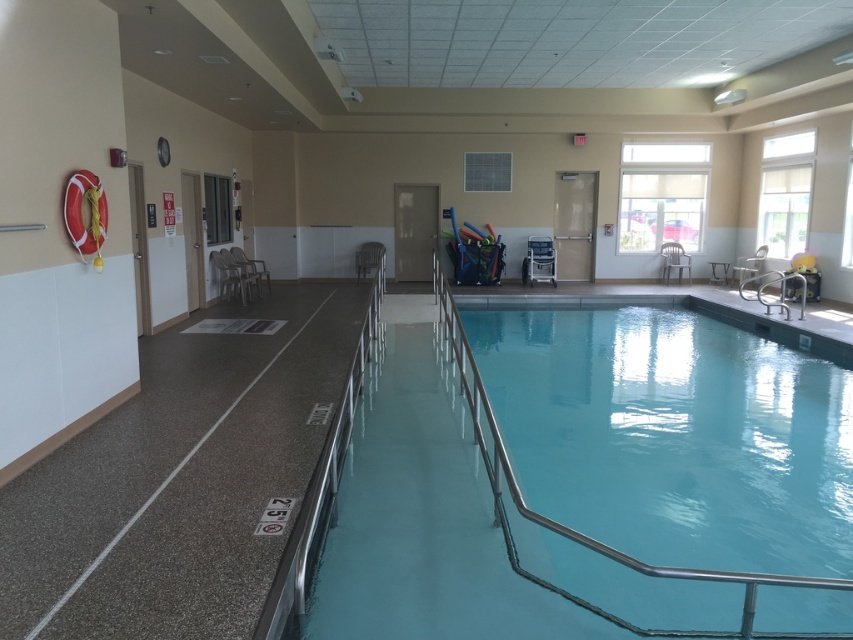
Does smooth blue water at center have a greater height compared to plastic/glossy chair at upper left?

Yes.

Can you confirm if smooth blue water at center is positioned to the right of plastic/glossy chair at upper left?

Yes, smooth blue water at center is to the right of plastic/glossy chair at upper left.

You are a GUI agent. You are given a task and a screenshot of the screen. Output one action in this format:
    pyautogui.click(x=<x>, y=<y>)
    Task: Click on the smooth blue water at center
    This screenshot has height=640, width=853.
    Given the screenshot: What is the action you would take?
    pyautogui.click(x=584, y=534)

This screenshot has width=853, height=640. I want to click on smooth blue water at center, so click(584, 534).

Can you confirm if white plastic chair at center is wider than metallic silver chair at right?

Correct, the width of white plastic chair at center exceeds that of metallic silver chair at right.

In the scene shown: Between white plastic chair at center and metallic silver chair at right, which one appears on the right side from the viewer's perspective?

metallic silver chair at right

The width and height of the screenshot is (853, 640). Describe the element at coordinates (674, 260) in the screenshot. I see `white plastic chair at center` at that location.

This screenshot has width=853, height=640. Identify the location of white plastic chair at center. (674, 260).

Which is more to the left, smooth blue water at center or blue plastic chair at center?

From the viewer's perspective, smooth blue water at center appears more on the left side.

Which is in front, point (844, 634) or point (541, 260)?

Point (844, 634)

Where is `smooth blue water at center`? Image resolution: width=853 pixels, height=640 pixels. smooth blue water at center is located at coordinates (584, 534).